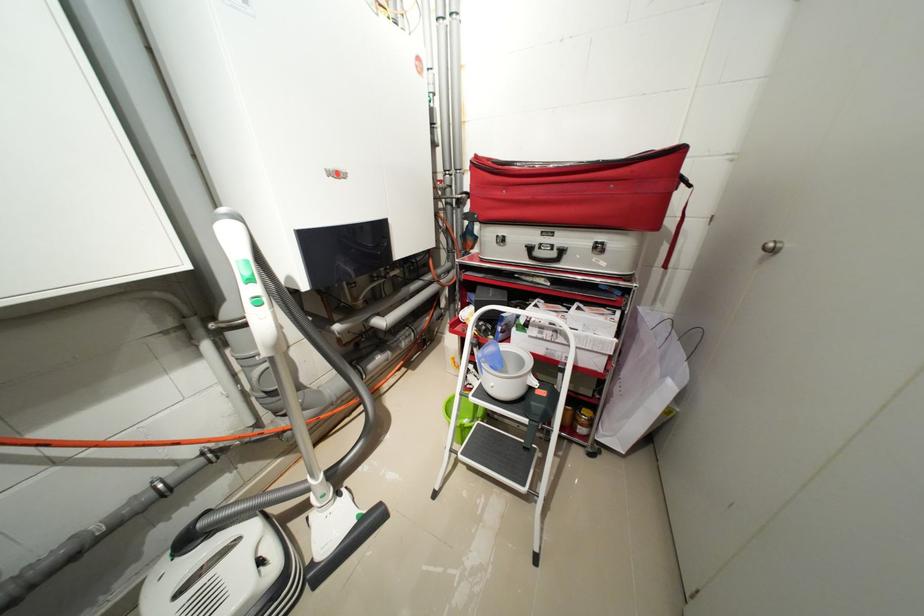
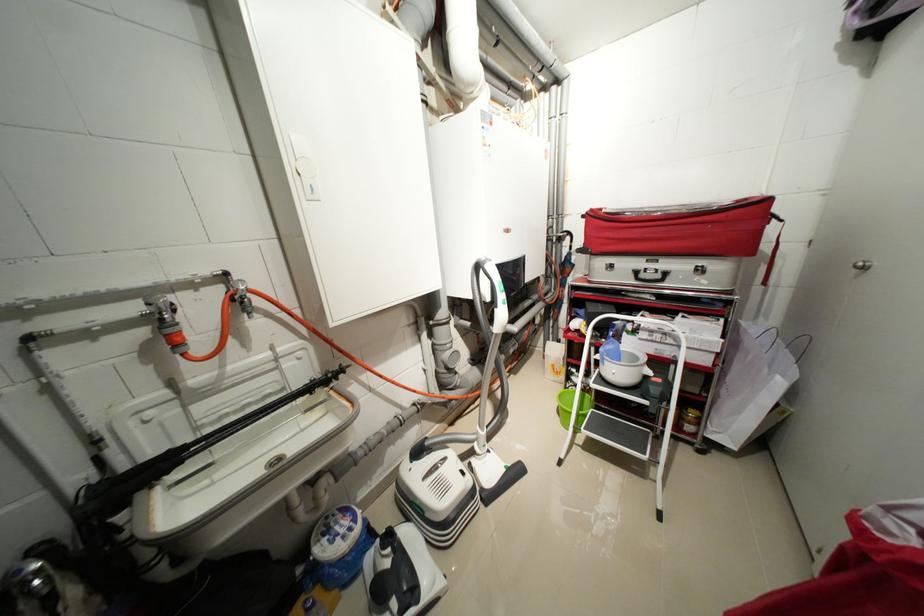
Locate, in the second image, the point that corresponds to (677,223) in the first image.

(772, 249)